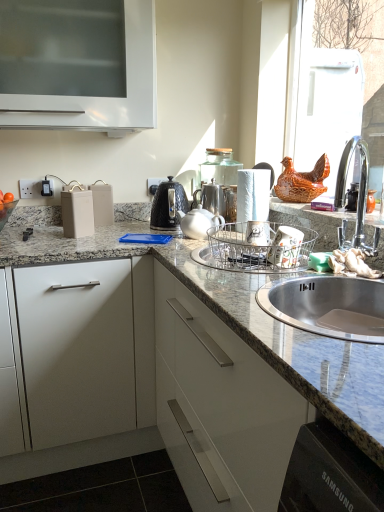
Question: Is white glossy refrigerator at upper right, the fourth appliance when ordered from left to right, in contact with granite at center?

Choices:
 (A) no
 (B) yes

Answer: (A)

Question: Is the depth of white glossy refrigerator at upper right, the first appliance viewed from the right, less than that of granite at center?

Choices:
 (A) yes
 (B) no

Answer: (B)

Question: From a real-world perspective, is white glossy refrigerator at upper right, the fourth appliance when ordered from left to right, positioned over granite at center based on gravity?

Choices:
 (A) no
 (B) yes

Answer: (B)

Question: Does white glossy refrigerator at upper right, the first appliance viewed from the right, have a lesser height compared to granite at center?

Choices:
 (A) no
 (B) yes

Answer: (B)

Question: Considering the relative sizes of white glossy refrigerator at upper right, the fourth appliance when ordered from left to right, and granite at center in the image provided, is white glossy refrigerator at upper right, the fourth appliance when ordered from left to right, taller than granite at center?

Choices:
 (A) yes
 (B) no

Answer: (B)

Question: Is white plastic electric outlet at left, placed as the 1th electric outlet when sorted from left to right, facing towards white glossy refrigerator at upper right, the first appliance viewed from the right?

Choices:
 (A) no
 (B) yes

Answer: (A)

Question: From the image's perspective, is white plastic electric outlet at left, placed as the 1th electric outlet when sorted from left to right, located above white glossy refrigerator at upper right, the fourth appliance when ordered from left to right?

Choices:
 (A) no
 (B) yes

Answer: (A)

Question: Considering the relative positions of white plastic electric outlet at left, the 2th electric outlet viewed from the right, and white glossy refrigerator at upper right, the first appliance viewed from the right, in the image provided, is white plastic electric outlet at left, the 2th electric outlet viewed from the right, to the right of white glossy refrigerator at upper right, the first appliance viewed from the right, from the viewer's perspective?

Choices:
 (A) yes
 (B) no

Answer: (B)

Question: Can you confirm if white plastic electric outlet at left, the 2th electric outlet viewed from the right, is thinner than white glossy refrigerator at upper right, the first appliance viewed from the right?

Choices:
 (A) no
 (B) yes

Answer: (B)

Question: Is white plastic electric outlet at left, the first electric outlet positioned from the front, shorter than white glossy refrigerator at upper right, the first appliance viewed from the right?

Choices:
 (A) no
 (B) yes

Answer: (B)

Question: Is white plastic electric outlet at left, the 2th electric outlet viewed from the right, closer to the viewer compared to white glossy refrigerator at upper right, the fourth appliance when ordered from left to right?

Choices:
 (A) no
 (B) yes

Answer: (A)

Question: Can you see metallic silver dish rack at sink, which is the second appliance from left to right, touching white matte drawer at left?

Choices:
 (A) no
 (B) yes

Answer: (A)